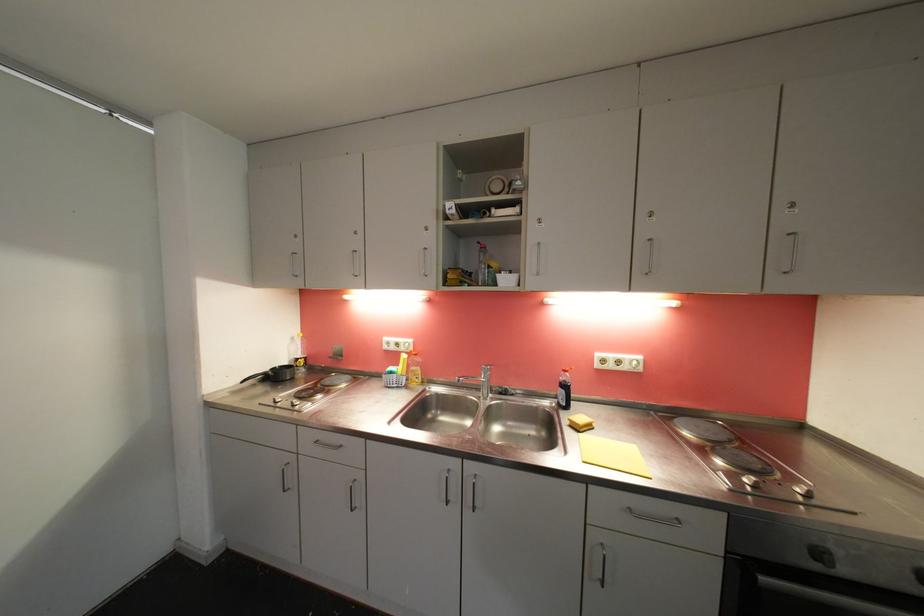
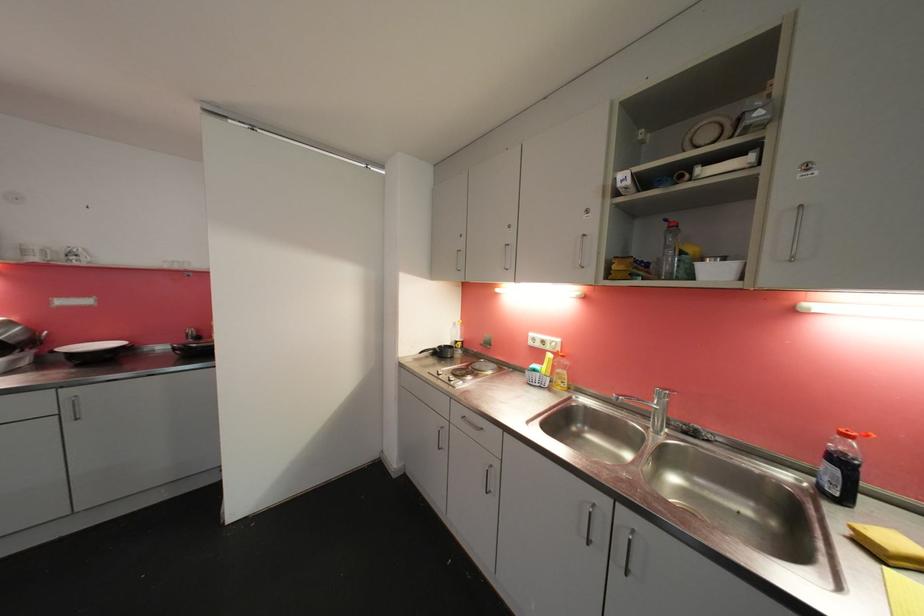
In the second image, find the point that corresponds to [573,424] in the first image.

(853, 533)